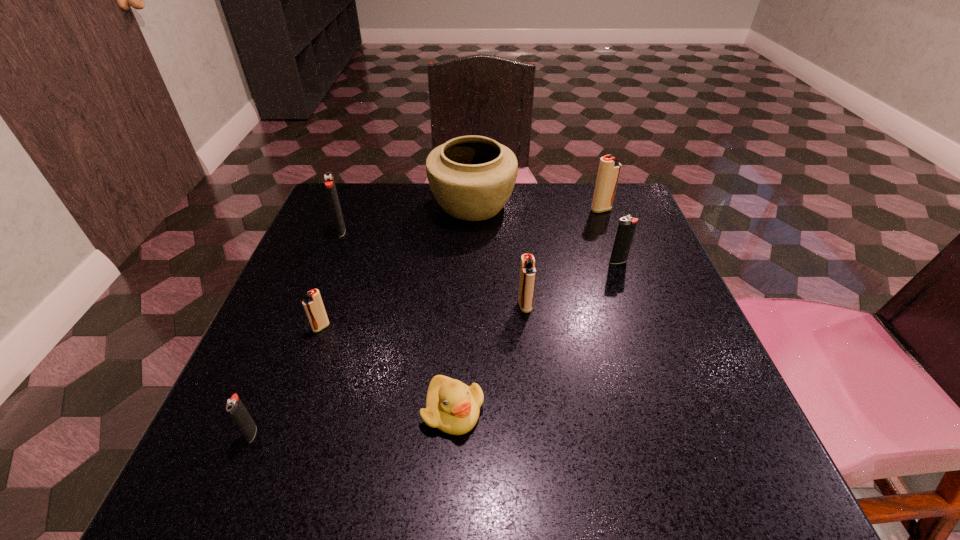
The height and width of the screenshot is (540, 960). Identify the location of free space between the duckling and the smallest black igniter. (352, 422).

Identify the location of free space between the fifth farthest object and the smallest black igniter. (389, 369).

Locate an element on the screen. vacant region between the farthest igniter and the sixth object from right to left is located at coordinates (461, 268).

Locate an element on the screen. This screenshot has height=540, width=960. vacant region between the biggest red igniter and the nearest black igniter is located at coordinates (426, 321).

The image size is (960, 540). Identify the location of the closest object relative to the fifth farthest object. (453, 407).

Identify which object is the fifth closest to the smallest black igniter. Please provide its 2D coordinates. Your answer should be formatted as a tuple, i.e. [(x, y)], where the tuple contains the x and y coordinates of a point satisfying the conditions above.

[(472, 177)]

Select which igniter is the closest to the biggest black igniter. Please provide its 2D coordinates. Your answer should be formatted as a tuple, i.e. [(x, y)], where the tuple contains the x and y coordinates of a point satisfying the conditions above.

[(313, 305)]

In order to click on the closest igniter to the farthest black igniter in this screenshot , I will do `click(313, 305)`.

Identify which red igniter is the third nearest to the rightmost black igniter. Please provide its 2D coordinates. Your answer should be formatted as a tuple, i.e. [(x, y)], where the tuple contains the x and y coordinates of a point satisfying the conditions above.

[(313, 305)]

This screenshot has height=540, width=960. Find the location of `red igniter that is the nearest to the second farthest black igniter`. red igniter that is the nearest to the second farthest black igniter is located at coordinates (609, 168).